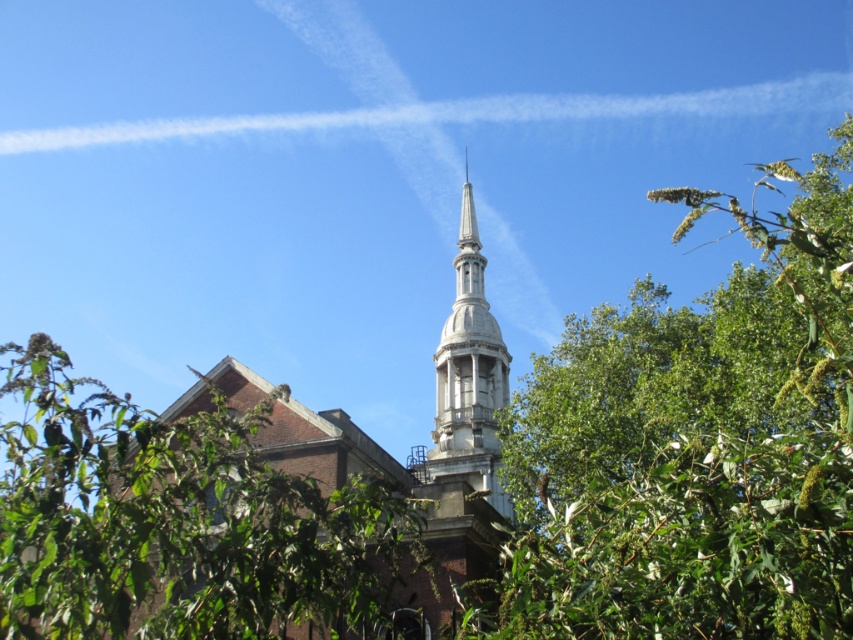
Is green leafy tree at upper center smaller than green leafy tree at center?

No, green leafy tree at upper center is not smaller than green leafy tree at center.

In the scene shown: Can you confirm if green leafy tree at upper center is positioned to the left of green leafy tree at center?

In fact, green leafy tree at upper center is to the right of green leafy tree at center.

Between point (813, 589) and point (105, 598), which one is positioned behind?

Positioned behind is point (105, 598).

Image resolution: width=853 pixels, height=640 pixels. What are the coordinates of `green leafy tree at upper center` in the screenshot? It's located at (694, 445).

Image resolution: width=853 pixels, height=640 pixels. Describe the element at coordinates (430, 435) in the screenshot. I see `white stone church steeple at upper center` at that location.

Between point (485, 566) and point (445, 376), which one is positioned in front?

Point (485, 566) is in front.

This screenshot has width=853, height=640. Identify the location of white stone church steeple at upper center. (430, 435).

Does point (317, 493) lie in front of point (466, 440)?

Yes, point (317, 493) is in front of point (466, 440).

Who is higher up, green leafy tree at center or white stone church steeple at upper center?

white stone church steeple at upper center is higher up.

Is point (181, 561) positioned before point (271, 444)?

That is True.

This screenshot has height=640, width=853. I want to click on green leafy tree at center, so click(178, 522).